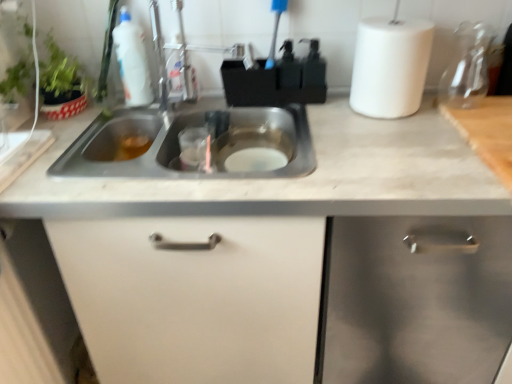
The height and width of the screenshot is (384, 512). In order to click on free space in front of white matte paper towel at upper right in this screenshot , I will do `click(415, 133)`.